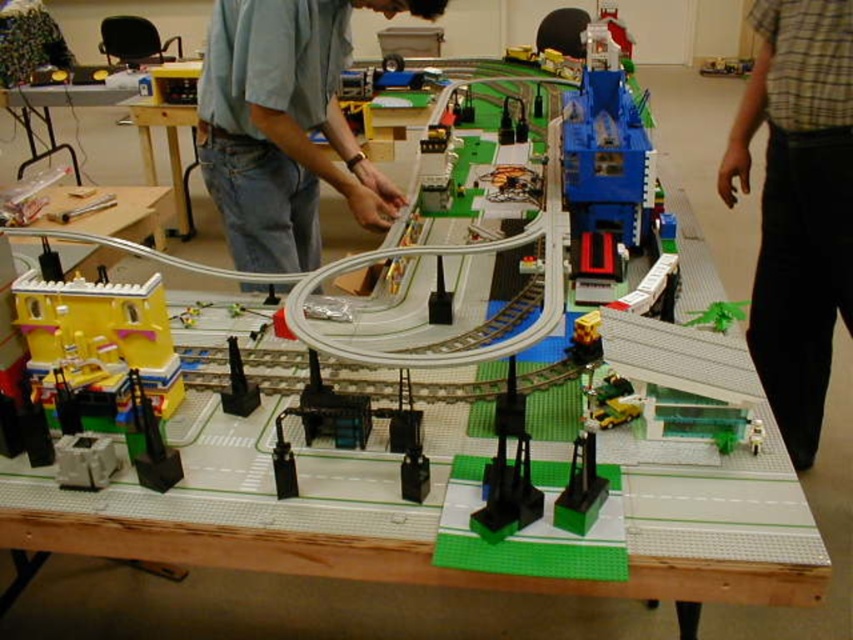
You are a model train enthusiast who wants to place a new LEGO figure wearing a plaid shirt at right next to the blue plastic crane at center. Considering their sizes, which one should you place first to ensure they both fit properly?

The plaid shirt at right is wider than the blue plastic crane at center, so you should place the plaid shirt at right first to ensure there is enough space for both.

You are a toy train operator who needs to place a small LEGO figure on the tallest object in the scene. Which object should you choose between the yellow plastic building at lower left and the white plastic table at upper left?

The white plastic table at upper left is taller than the yellow plastic building at lower left, so you should place the LEGO figure on the white plastic table at upper left.